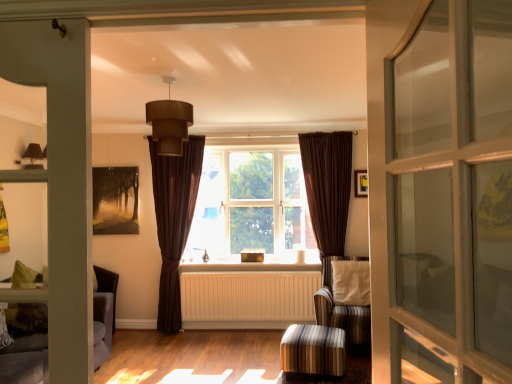
I want to click on free space above white matte radiator at center (from a real-world perspective), so click(244, 269).